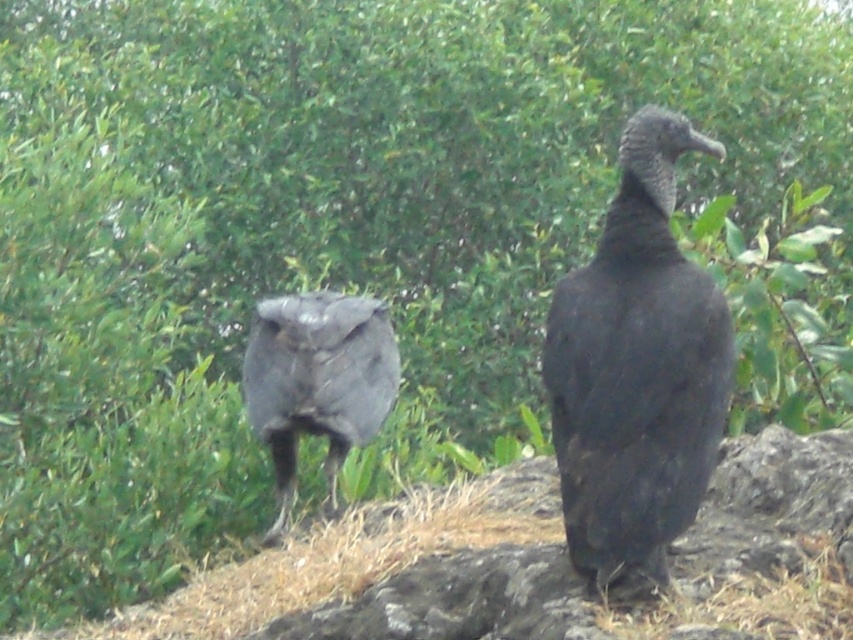
Question: Where is matte black vulture at center located in relation to shiny black bird at center in the image?

Choices:
 (A) below
 (B) above

Answer: (B)

Question: Does matte black vulture at center appear on the left side of shiny black bird at center?

Choices:
 (A) no
 (B) yes

Answer: (A)

Question: Which of the following is the closest to the observer?

Choices:
 (A) matte black vulture at center
 (B) shiny black bird at center

Answer: (A)

Question: Which object appears farthest from the camera in this image?

Choices:
 (A) shiny black bird at center
 (B) matte black vulture at center

Answer: (A)

Question: Does matte black vulture at center have a greater width compared to shiny black bird at center?

Choices:
 (A) yes
 (B) no

Answer: (B)